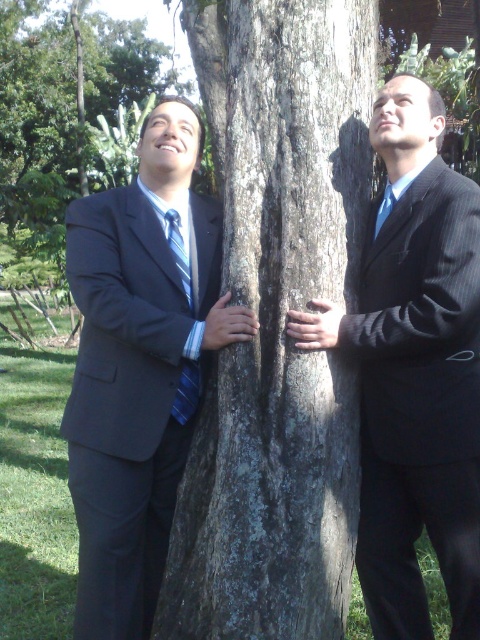
You are a photographer adjusting the focus on your camera. You need to ensure both the blue striped tie at left and the solid blue tie at right are in focus. Which tie is closer to the camera based on their positions?

The blue striped tie at left is located at point [189,376], so it is closer to the camera than the solid blue tie at right.

You are a photographer setting up for a group photo. You need to ensure that the matte black suit at left and the dark brown textured bark at center are both visible in the frame. Based on their sizes, which object should you focus on first to ensure proper framing?

The matte black suit at left has a lesser width compared to the dark brown textured bark at center, so you should focus on the dark brown textured bark at center first since it is wider and might require more attention to fit properly in the frame.

You are a photographer adjusting the camera settings to ensure both ties are clearly visible. Since the blue striped tie at left and the blue silk tie at right are different in width, which one might require more careful focus due to its larger size?

The blue striped tie at left is wider than the blue silk tie at right, so it might require more careful focus due to its larger size.